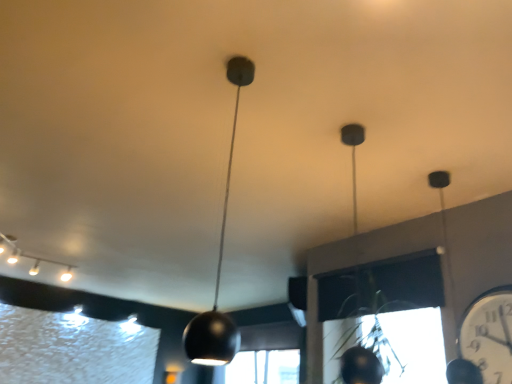
Question: From their relative heights in the image, would you say matte black pendant light at center, the second lamp positioned from the left, is taller or shorter than white glossy track lights at upper left, the 2th lamp viewed from the front?

Choices:
 (A) tall
 (B) short

Answer: (A)

Question: From the image's perspective, is matte black pendant light at center, which is the first lamp from right to left, above or below white glossy track lights at upper left, marked as the second lamp in a right-to-left arrangement?

Choices:
 (A) below
 (B) above

Answer: (B)

Question: Which object is the closest to the white glossy clock at right?

Choices:
 (A) matte black pendant light at center, the 1th lamp positioned from the front
 (B) white glossy track lights at upper left, the 2th lamp viewed from the front

Answer: (A)

Question: Estimate the real-world distances between objects in this image. Which object is farther from the white glossy track lights at upper left, positioned as the 1th lamp in back-to-front order?

Choices:
 (A) white glossy clock at right
 (B) matte black pendant light at center, marked as the second lamp in a back-to-front arrangement

Answer: (A)